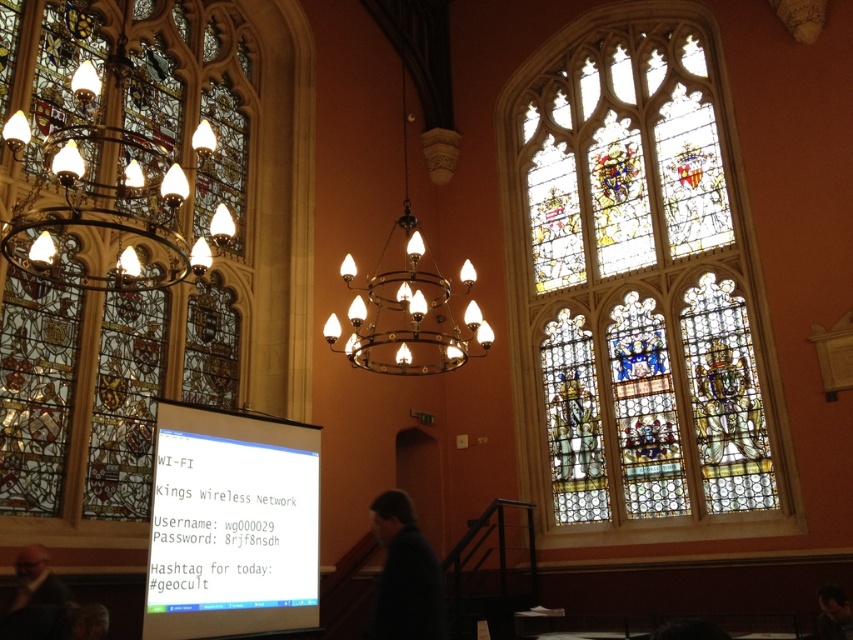
Question: Observing the image, what is the correct spatial positioning of stained glass window at center in reference to white glossy projection screen at lower left?

Choices:
 (A) below
 (B) above

Answer: (B)

Question: Which of the following is the closest to the observer?

Choices:
 (A) (33, 618)
 (B) (825, 620)

Answer: (A)

Question: Which of the following is the farthest from the observer?

Choices:
 (A) dark brown leather jacket at lower right
 (B) stained glass window at center
 (C) dark brown leather jacket at lower left
 (D) dark blue jacket at center

Answer: (B)

Question: Which point is closer to the camera taking this photo?

Choices:
 (A) (132, 115)
 (B) (412, 280)
 (C) (21, 596)
 (D) (834, 620)

Answer: (C)

Question: In this image, where is matte brass chandelier at center located relative to dark brown leather jacket at lower left?

Choices:
 (A) right
 (B) left

Answer: (A)

Question: Is dark brown leather jacket at lower left to the left of dark brown leather jacket at lower right from the viewer's perspective?

Choices:
 (A) no
 (B) yes

Answer: (B)